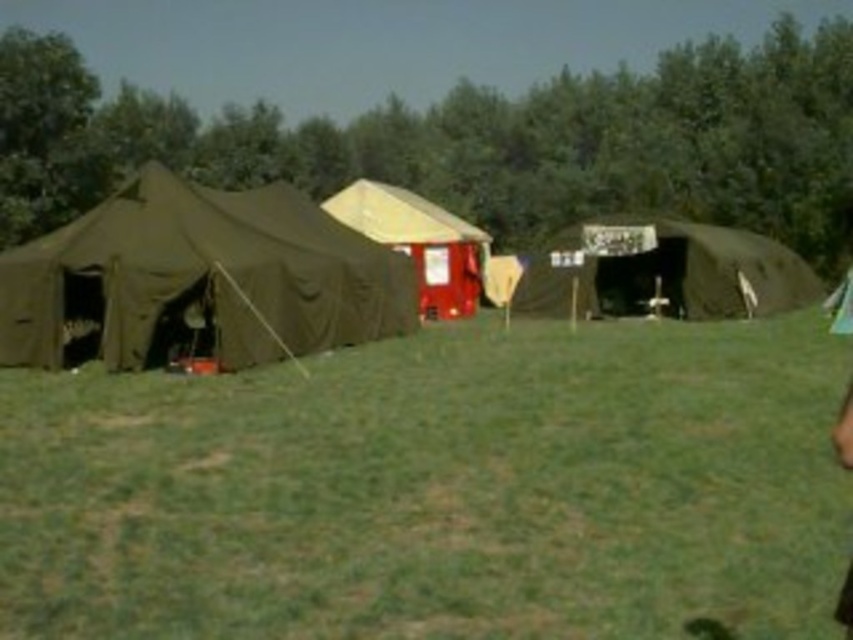
Question: Is matte green tent at center to the right of red plastic tent at center from the viewer's perspective?

Choices:
 (A) yes
 (B) no

Answer: (A)

Question: Estimate the real-world distances between objects in this image. Which object is farther from the green grass at center?

Choices:
 (A) olive green canvas tent at left
 (B) red plastic tent at center
 (C) matte green tent at center

Answer: (C)

Question: Can you confirm if green grass at center is positioned below matte green tent at center?

Choices:
 (A) yes
 (B) no

Answer: (A)

Question: Which object is closer to the camera taking this photo?

Choices:
 (A) matte green tent at center
 (B) green grass at center
 (C) olive green canvas tent at left
 (D) red plastic tent at center

Answer: (B)

Question: Can you confirm if green grass at center is positioned to the left of red plastic tent at center?

Choices:
 (A) no
 (B) yes

Answer: (B)

Question: Which object is farther from the camera taking this photo?

Choices:
 (A) olive green canvas tent at left
 (B) red plastic tent at center

Answer: (B)